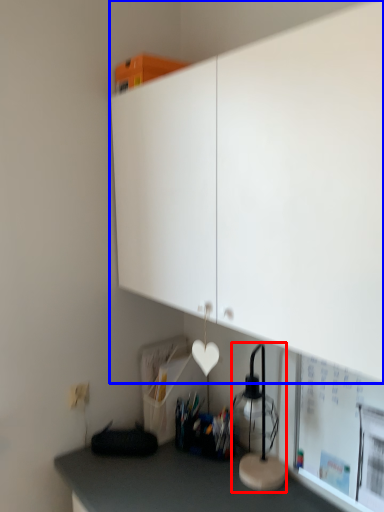
Question: Which point is closer to the camera, table lamp (highlighted by a red box) or cabinetry (highlighted by a blue box)?

Choices:
 (A) table lamp
 (B) cabinetry

Answer: (B)